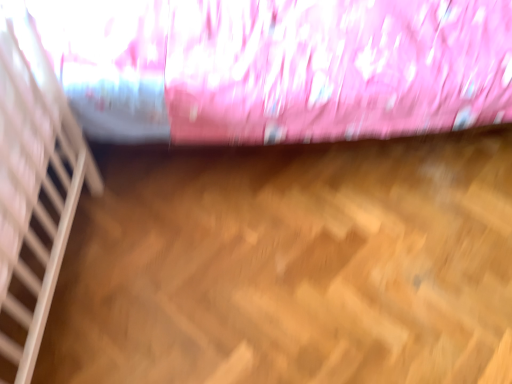
The width and height of the screenshot is (512, 384). What do you see at coordinates (34, 179) in the screenshot?
I see `white wooden stairwell at left` at bounding box center [34, 179].

At what (x,y) coordinates should I click in order to perform the action: click on white wooden stairwell at left. Please return your answer as a coordinate pair (x, y). Looking at the image, I should click on (34, 179).

Where is `pink satin curtain at upper center`? The image size is (512, 384). pink satin curtain at upper center is located at coordinates (278, 67).

The height and width of the screenshot is (384, 512). Describe the element at coordinates (278, 67) in the screenshot. I see `pink satin curtain at upper center` at that location.

Identify the location of white wooden stairwell at left. pos(34,179).

Consider the image. Considering the positions of objects pink satin curtain at upper center and white wooden stairwell at left in the image provided, who is more to the right, pink satin curtain at upper center or white wooden stairwell at left?

pink satin curtain at upper center.

Relative to white wooden stairwell at left, is pink satin curtain at upper center in front or behind?

pink satin curtain at upper center is positioned farther from the viewer than white wooden stairwell at left.

Does point (118, 30) appear closer or farther from the camera than point (63, 95)?

Point (118, 30) is farther from the camera than point (63, 95).

From the image's perspective, does pink satin curtain at upper center appear lower than white wooden stairwell at left?

No, from the image's perspective, pink satin curtain at upper center is not beneath white wooden stairwell at left.

From a real-world perspective, is pink satin curtain at upper center below white wooden stairwell at left?

Yes, from a real-world perspective, pink satin curtain at upper center is below white wooden stairwell at left.

Is pink satin curtain at upper center wider or thinner than white wooden stairwell at left?

Considering their sizes, pink satin curtain at upper center looks broader than white wooden stairwell at left.

Between pink satin curtain at upper center and white wooden stairwell at left, which one has more height?

pink satin curtain at upper center.

Considering the sizes of objects pink satin curtain at upper center and white wooden stairwell at left in the image provided, who is smaller, pink satin curtain at upper center or white wooden stairwell at left?

With smaller size is white wooden stairwell at left.

Would you say pink satin curtain at upper center is outside white wooden stairwell at left?

Indeed, pink satin curtain at upper center is completely outside white wooden stairwell at left.

Is pink satin curtain at upper center far away from white wooden stairwell at left?

pink satin curtain at upper center is near white wooden stairwell at left, not far away.

Looking at this image, could you tell me if pink satin curtain at upper center is facing white wooden stairwell at left?

Yes, pink satin curtain at upper center is oriented towards white wooden stairwell at left.

Can you tell me how much pink satin curtain at upper center and white wooden stairwell at left differ in facing direction?

The angular difference between pink satin curtain at upper center and white wooden stairwell at left is 89.7 degrees.

Locate an element on the screen. curtain above the white wooden stairwell at left (from the image's perspective) is located at coordinates (278, 67).

Considering the relative positions of white wooden stairwell at left and pink satin curtain at upper center in the image provided, is white wooden stairwell at left to the right of pink satin curtain at upper center from the viewer's perspective?

Incorrect, white wooden stairwell at left is not on the right side of pink satin curtain at upper center.

Is white wooden stairwell at left in front of or behind pink satin curtain at upper center in the image?

Clearly, white wooden stairwell at left is in front of pink satin curtain at upper center.

Between point (24, 276) and point (447, 123), which one is positioned behind?

The point (447, 123) is farther.

From the image's perspective, which is below, white wooden stairwell at left or pink satin curtain at upper center?

white wooden stairwell at left is shown below in the image.

From a real-world perspective, is white wooden stairwell at left positioned above or below pink satin curtain at upper center?

white wooden stairwell at left is situated higher than pink satin curtain at upper center in the real world.

Is white wooden stairwell at left wider than pink satin curtain at upper center?

Incorrect, the width of white wooden stairwell at left does not surpass that of pink satin curtain at upper center.

Who is shorter, white wooden stairwell at left or pink satin curtain at upper center?

Standing shorter between the two is white wooden stairwell at left.

Does white wooden stairwell at left have a larger size compared to pink satin curtain at upper center?

Incorrect, white wooden stairwell at left is not larger than pink satin curtain at upper center.

Is white wooden stairwell at left inside or outside of pink satin curtain at upper center?

white wooden stairwell at left exists outside the volume of pink satin curtain at upper center.

Are white wooden stairwell at left and pink satin curtain at upper center located far from each other?

That's not correct — white wooden stairwell at left is a little close to pink satin curtain at upper center.

Is pink satin curtain at upper center at the back of white wooden stairwell at left?

No, pink satin curtain at upper center is not at the back of white wooden stairwell at left.

How many degrees apart are the facing directions of white wooden stairwell at left and pink satin curtain at upper center?

The angular difference between white wooden stairwell at left and pink satin curtain at upper center is 89.7 degrees.

Find the location of a particular element. The height and width of the screenshot is (384, 512). curtain that appears on the right of white wooden stairwell at left is located at coordinates (278, 67).

Identify the location of curtain on the right of the white wooden stairwell at left. (278, 67).

Where is `stairwell above the pink satin curtain at upper center (from a real-world perspective)`? stairwell above the pink satin curtain at upper center (from a real-world perspective) is located at coordinates (34, 179).